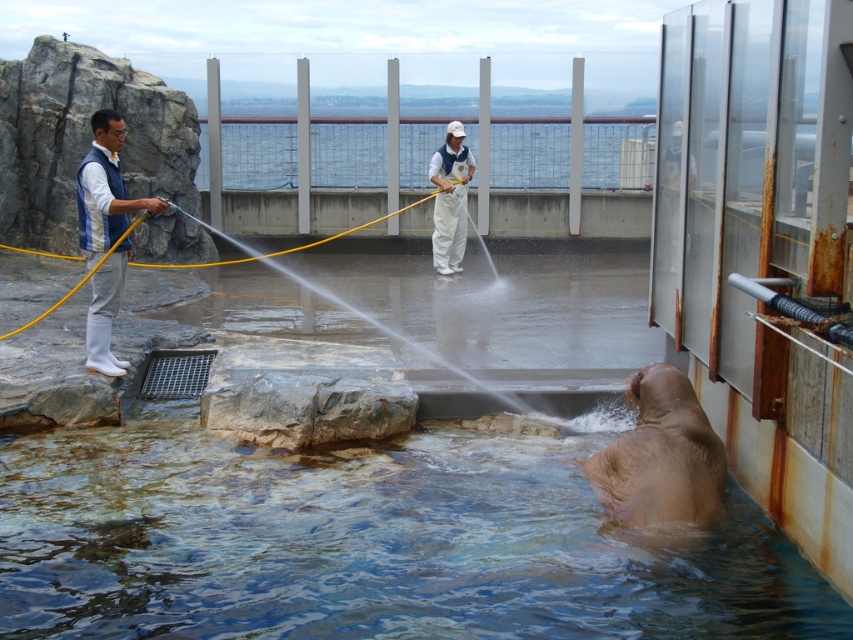
Question: Is brown matte hippo at lower center above white matte uniform at center?

Choices:
 (A) no
 (B) yes

Answer: (A)

Question: Estimate the real-world distances between objects in this image. Which object is closer to the yellow rubber hose at left?

Choices:
 (A) brown matte hippo at lower center
 (B) clear water at lower center
 (C) white matte uniform at center

Answer: (C)

Question: Does clear water at lower center have a larger size compared to white matte vest at left?

Choices:
 (A) yes
 (B) no

Answer: (A)

Question: Which object is the closest to the clear water at lower center?

Choices:
 (A) brown matte hippo at lower center
 (B) white matte vest at left

Answer: (A)

Question: Is clear water at lower center positioned at the back of brown matte hippo at lower center?

Choices:
 (A) no
 (B) yes

Answer: (A)

Question: Which point is farther to the camera?

Choices:
 (A) (706, 522)
 (B) (416, 566)
 (C) (463, 145)
 (D) (28, 250)

Answer: (C)